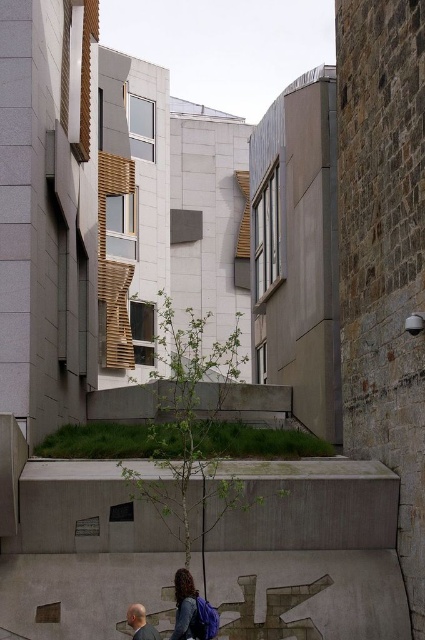
Is green leafy tree at center in front of gray hair man at lower left?

No, it is not.

Between green leafy tree at center and gray hair man at lower left, which one appears on the right side from the viewer's perspective?

green leafy tree at center is more to the right.

This screenshot has height=640, width=425. I want to click on green leafy tree at center, so click(189, 428).

Identify the location of green leafy tree at center. (189, 428).

Between point (195, 435) and point (197, 612), which one is positioned in front?

Point (197, 612) is in front.

Between green leafy tree at center and matte blue backpack at lower center, which one appears on the right side from the viewer's perspective?

From the viewer's perspective, matte blue backpack at lower center appears more on the right side.

What do you see at coordinates (189, 428) in the screenshot? This screenshot has height=640, width=425. I see `green leafy tree at center` at bounding box center [189, 428].

Where is `green leafy tree at center`? The width and height of the screenshot is (425, 640). green leafy tree at center is located at coordinates (189, 428).

Is matte blue backpack at lower center taller than gray hair man at lower left?

Correct, matte blue backpack at lower center is much taller as gray hair man at lower left.

Which is in front, point (181, 593) or point (153, 632)?

Positioned in front is point (153, 632).

You are a GUI agent. You are given a task and a screenshot of the screen. Output one action in this format:
    pyautogui.click(x=<x>, y=<y>)
    Task: Click on the matte blue backpack at lower center
    
    Given the screenshot: What is the action you would take?
    pyautogui.click(x=192, y=611)